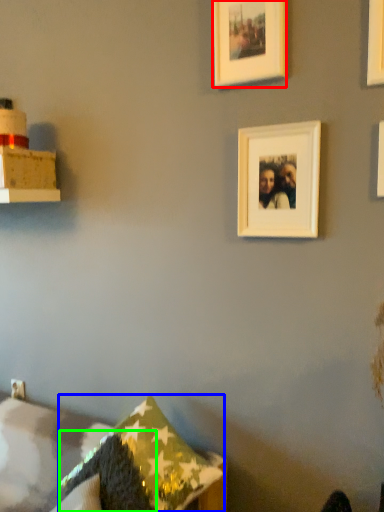
Question: Which object is positioned closest to picture frame (highlighted by a red box)? Select from pillow (highlighted by a blue box) and pillow (highlighted by a green box).

Choices:
 (A) pillow
 (B) pillow

Answer: (A)